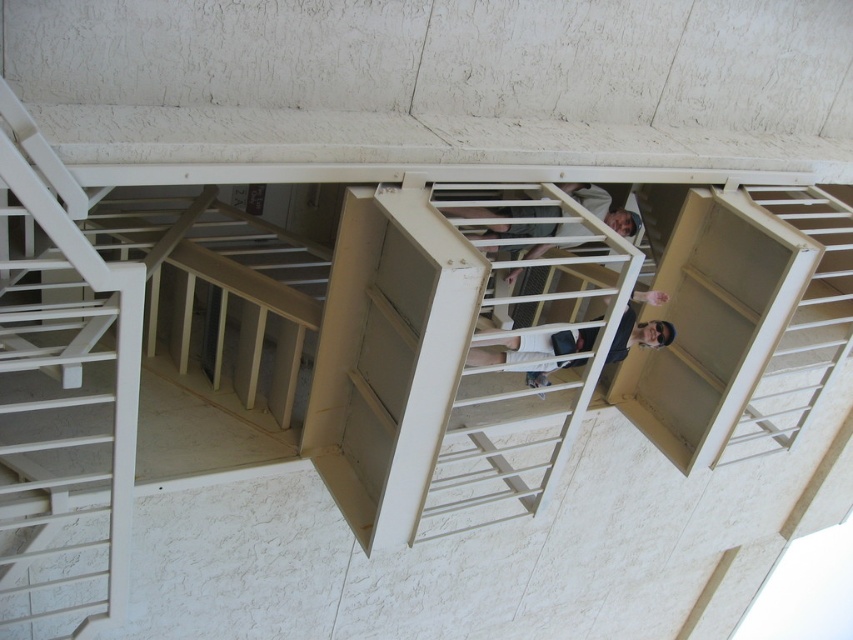
Consider the image. Is white matte ladder at left positioned at the back of matte white shirt at center?

No, it is not.

Between white matte ladder at left and matte white shirt at center, which one appears on the left side from the viewer's perspective?

white matte ladder at left is more to the left.

Between point (119, 358) and point (532, 346), which one is positioned in front?

Point (119, 358)

You are a GUI agent. You are given a task and a screenshot of the screen. Output one action in this format:
    pyautogui.click(x=<x>, y=<y>)
    Task: Click on the white matte ladder at left
    
    Given the screenshot: What is the action you would take?
    pyautogui.click(x=61, y=396)

Does matte white shirt at center have a lesser height compared to matte white shirt at upper center?

Yes, matte white shirt at center is shorter than matte white shirt at upper center.

Does point (532, 346) come farther from viewer compared to point (582, 193)?

That is False.

I want to click on matte white shirt at center, so click(x=531, y=346).

Who is positioned more to the left, white matte stair at upper right or matte white shirt at upper center?

From the viewer's perspective, matte white shirt at upper center appears more on the left side.

Is point (816, 193) farther from viewer compared to point (505, 216)?

Yes.

The height and width of the screenshot is (640, 853). I want to click on white matte stair at upper right, so click(799, 324).